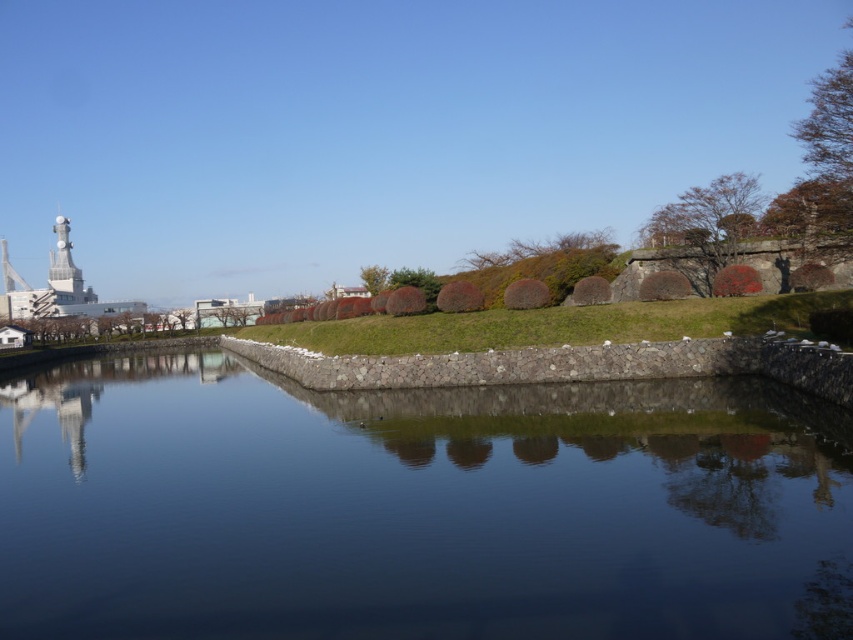
Question: Among these objects, which one is nearest to the camera?

Choices:
 (A) dark stone water at center
 (B) metallic silver tower at upper left

Answer: (A)

Question: Does dark stone water at center have a larger size compared to metallic silver tower at upper left?

Choices:
 (A) yes
 (B) no

Answer: (B)

Question: Is dark stone water at center thinner than metallic silver tower at upper left?

Choices:
 (A) yes
 (B) no

Answer: (A)

Question: Which object is closer to the camera taking this photo?

Choices:
 (A) metallic silver tower at upper left
 (B) dark stone water at center

Answer: (B)

Question: Is dark stone water at center positioned behind metallic silver tower at upper left?

Choices:
 (A) yes
 (B) no

Answer: (B)